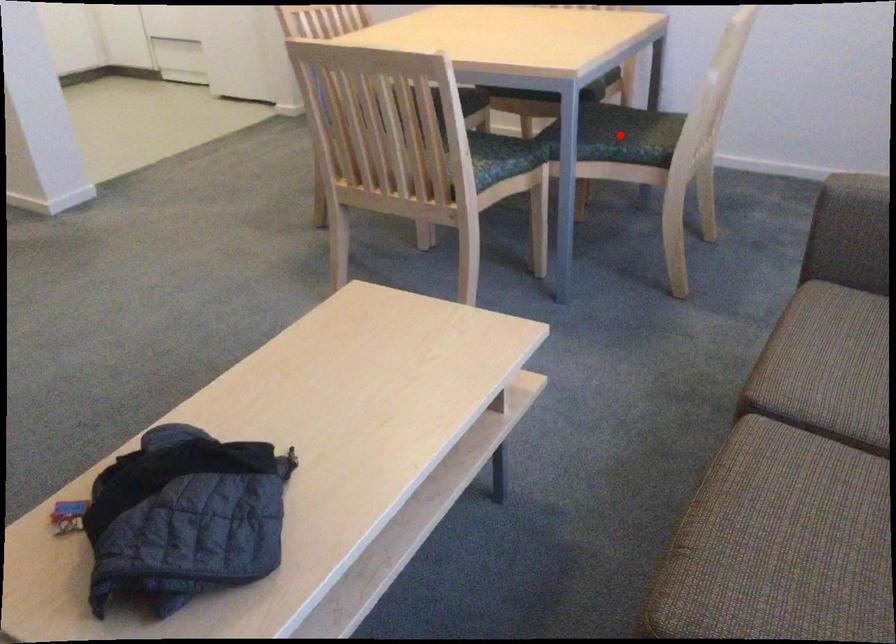
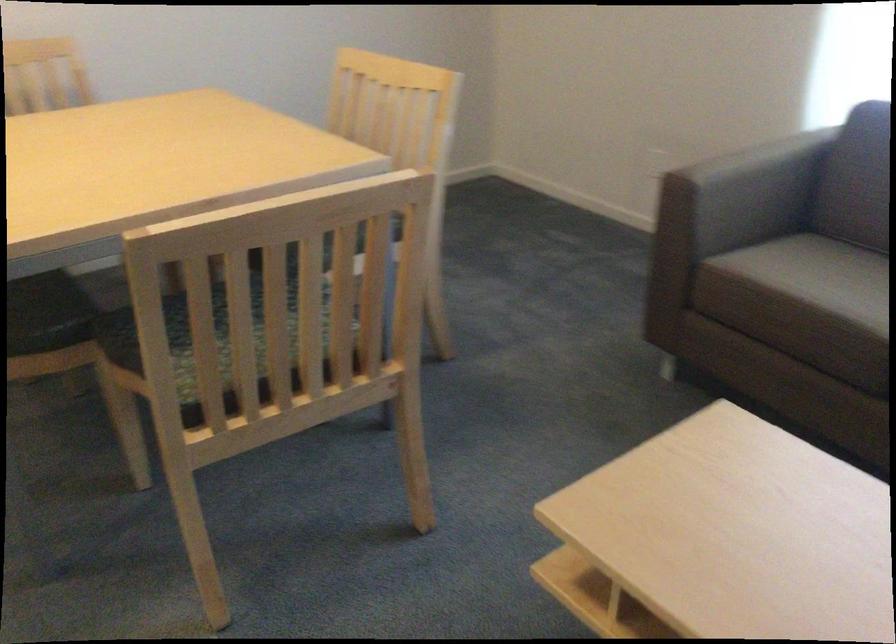
Question: I am providing you with two images of the same scene from different viewpoints. A red point is marked on the first image. At the location where the point appears in image 1, is it still visible in image 2?

Choices:
 (A) Yes
 (B) No

Answer: (B)